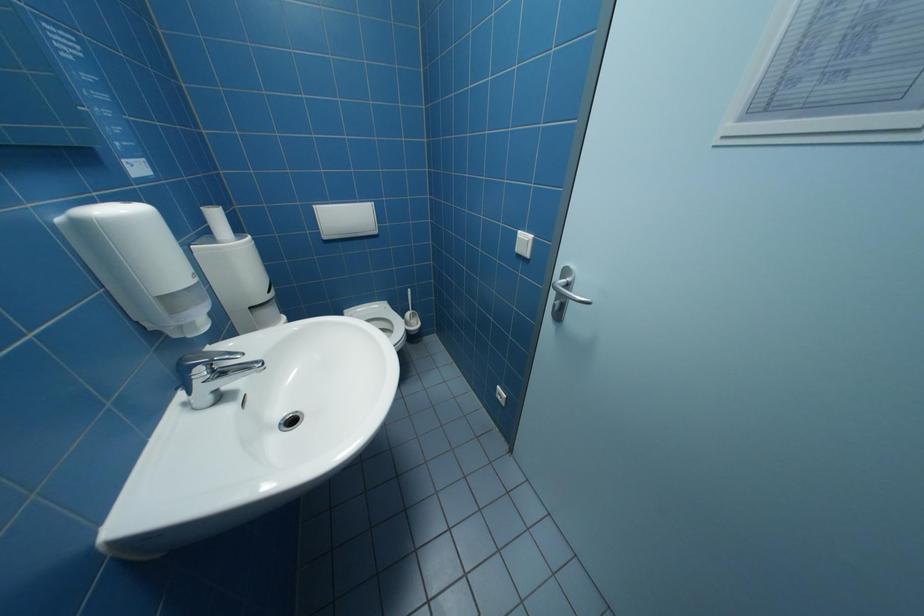
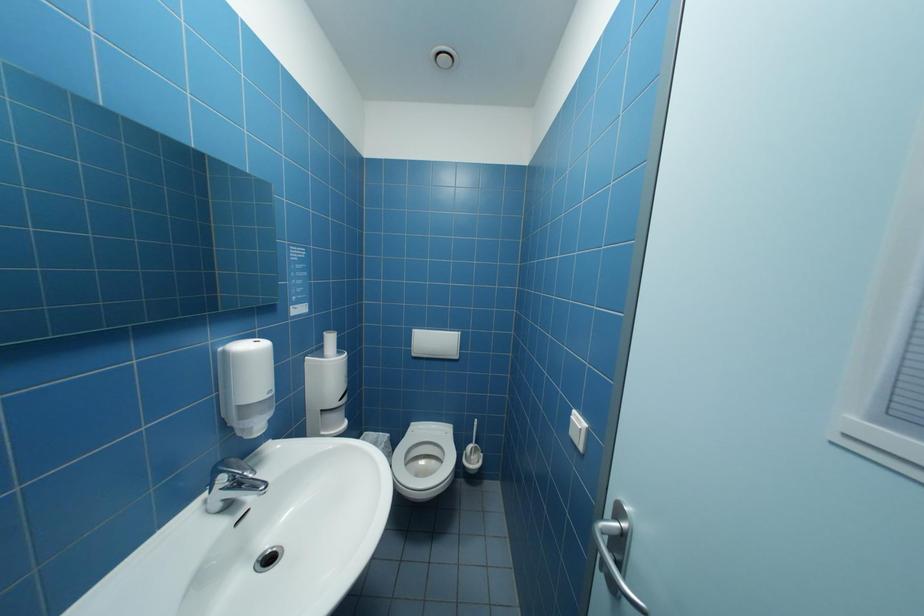
How did the camera likely rotate?

The rotation direction of the camera is left-up.